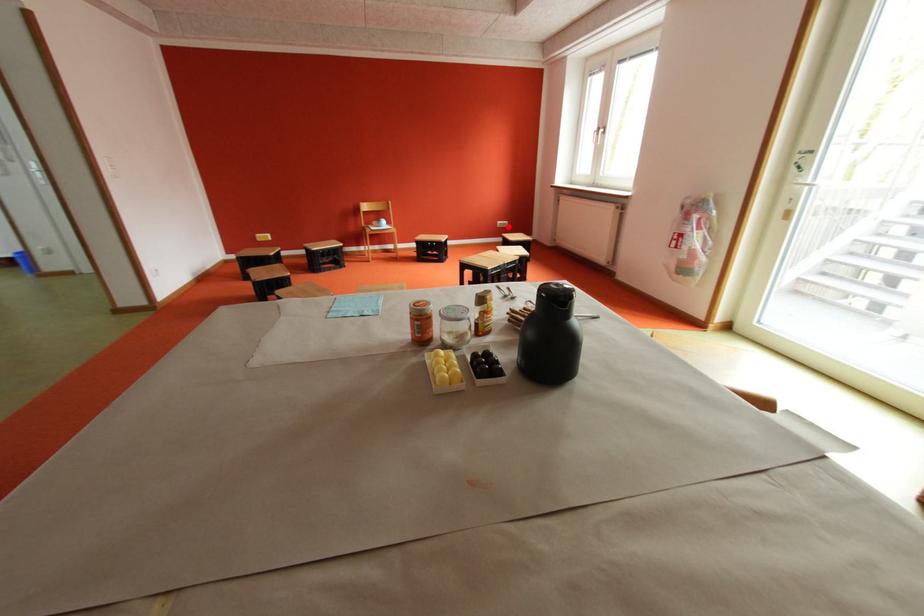
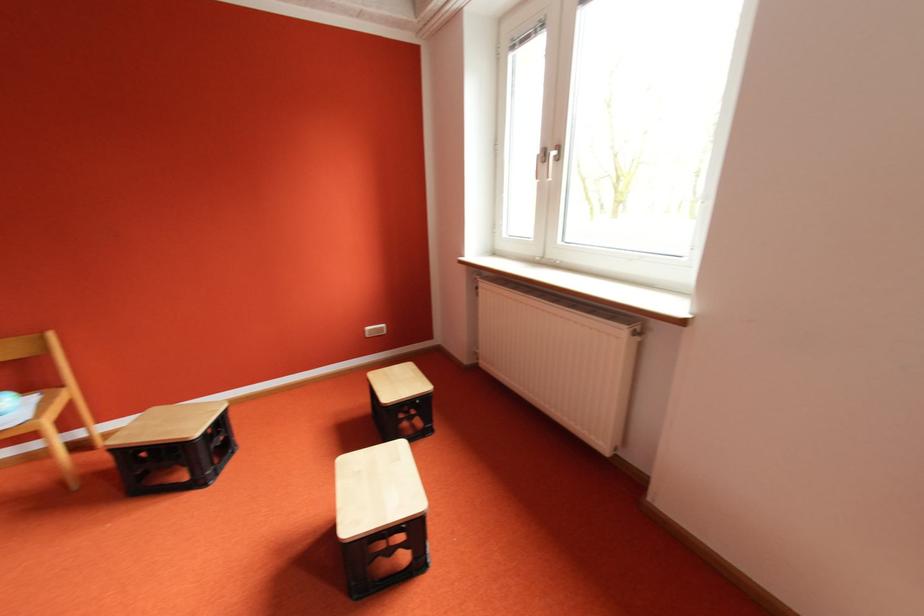
Locate, in the second image, the point that corresponds to the highlighted location in the first image.

(377, 336)